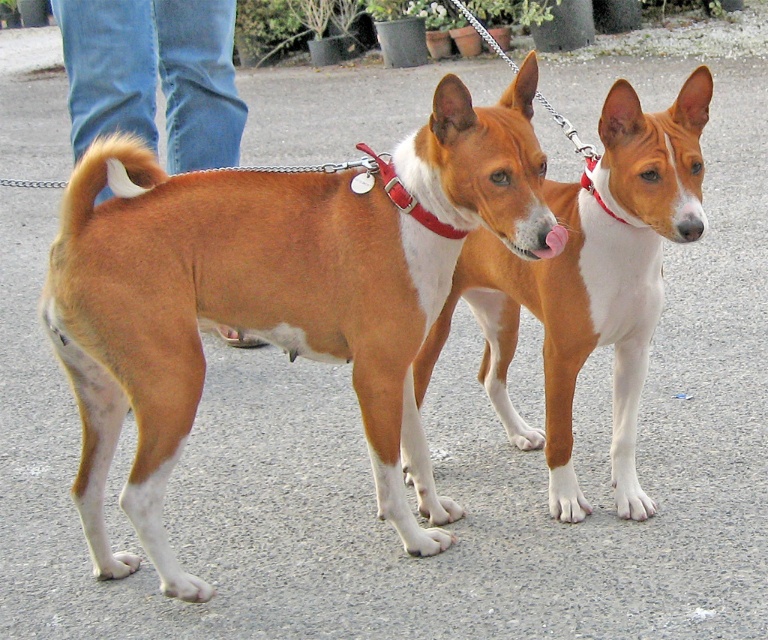
You are a photographer trying to capture the brown fur tail at lower left. Given that the camera is positioned at the point with coordinates point(154, 76), will the tail be in the frame?

The point(154, 76) corresponds to the brown fur tail at lower left, so yes, the tail will be in the frame.

You are a dog trainer observing two Basenjis. You notice a point labeled at coordinates (106, 177). Based on the scene description, what does this point likely represent?

The point at (106, 177) indicates the location of the brown fur tail at left.

You are a dog trainer observing two Basenjis. You notice the brown fur tail at left and the red nylon collar at center. Which object is positioned more to the left?

The brown fur tail at left is positioned more to the left than the red nylon collar at center.